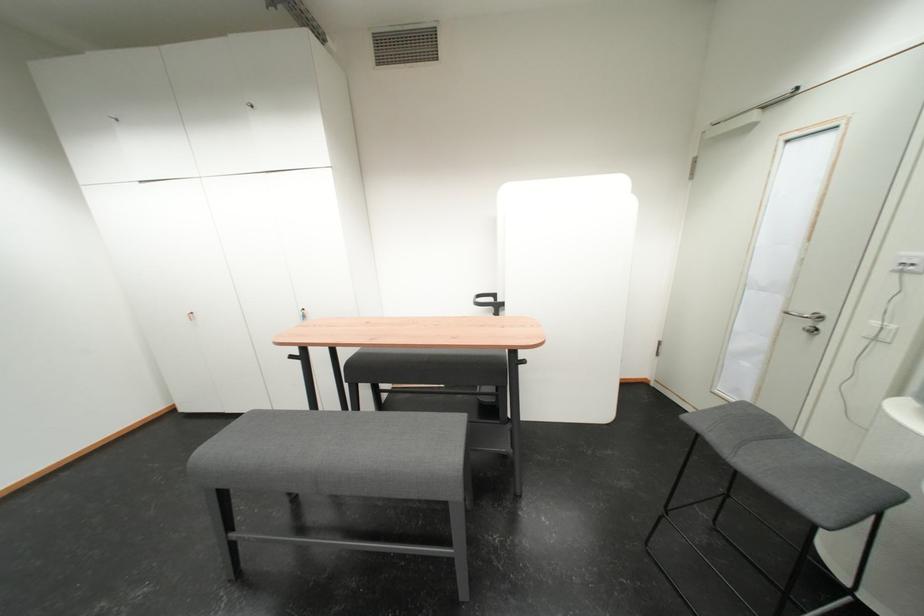
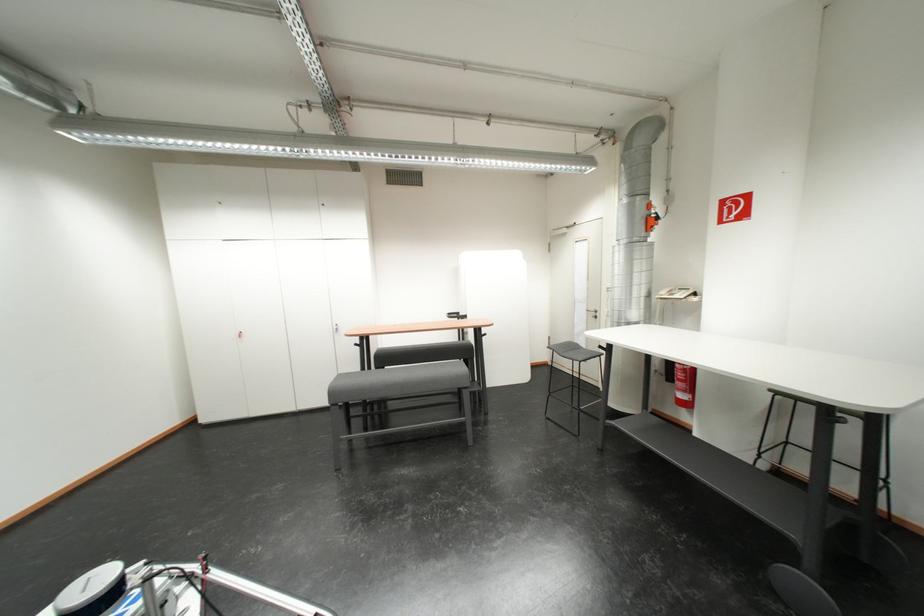
In a continuous first-person perspective shot, in which direction is the camera moving?

The cameraman moved toward left, backward.